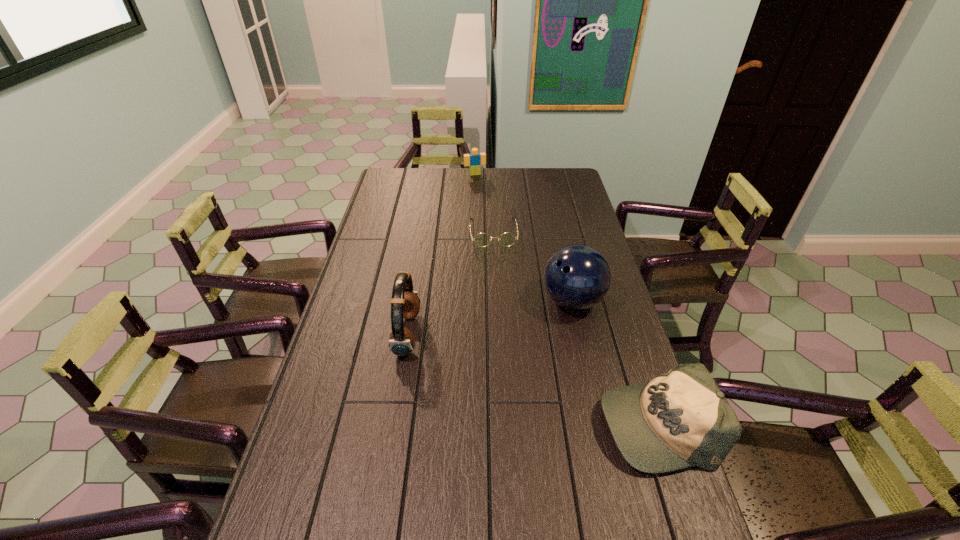
Identify the location of empty space that is in between the nearest object and the leftmost object. This screenshot has height=540, width=960. (532, 379).

In order to click on free space between the headset and the shortest object in this screenshot , I will do `click(450, 284)`.

This screenshot has height=540, width=960. I want to click on free point between the leftmost object and the farthest object, so click(x=442, y=254).

Identify the location of free point between the leftmost object and the baseball cap. The width and height of the screenshot is (960, 540). (532, 379).

Where is `free space between the farthest object and the bowling ball`? This screenshot has width=960, height=540. free space between the farthest object and the bowling ball is located at coordinates (523, 238).

You are a GUI agent. You are given a task and a screenshot of the screen. Output one action in this format:
    pyautogui.click(x=<x>, y=<y>)
    Task: Click on the empty space between the fourth nearest object and the farthest object
    The height and width of the screenshot is (540, 960).
    Given the screenshot: What is the action you would take?
    pyautogui.click(x=484, y=204)

Identify the location of the third closest object to the nearest object. The image size is (960, 540). (507, 239).

The width and height of the screenshot is (960, 540). I want to click on object that is the second closest to the baseball cap, so click(405, 303).